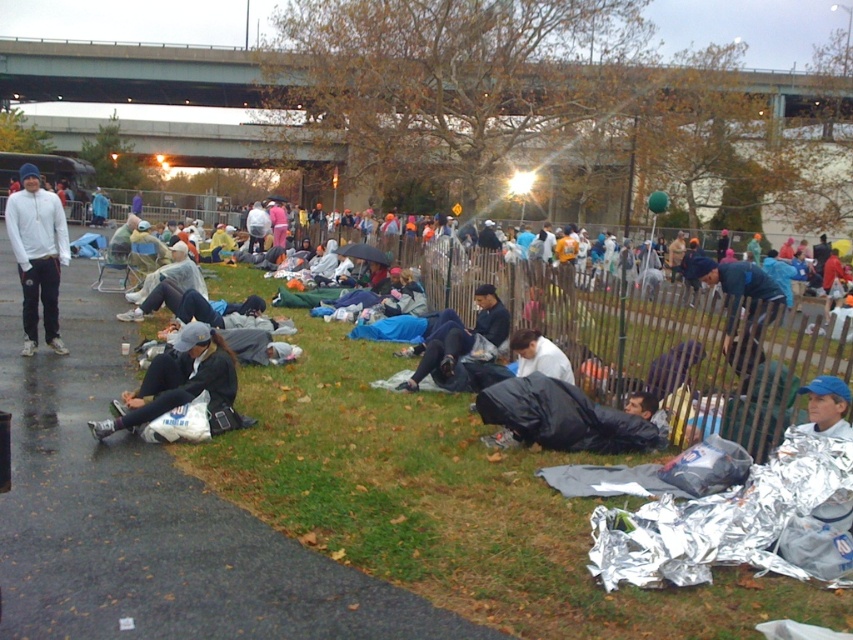
Question: Which object is the farthest from the metallic wire fence at center?

Choices:
 (A) white matte jacket at left
 (B) green concrete bridge at upper center
 (C) black asphalt at lower left
 (D) white matte shirt at center

Answer: (B)

Question: Observing the image, what is the correct spatial positioning of green concrete bridge at upper center in reference to blue matte jacket at lower right?

Choices:
 (A) left
 (B) right

Answer: (A)

Question: Estimate the real-world distances between objects in this image. Which object is farther from the black asphalt at lower left?

Choices:
 (A) white matte jacket at left
 (B) green concrete bridge at upper center
 (C) white matte shirt at center

Answer: (B)

Question: Which point appears farthest from the camera in this image?

Choices:
 (A) (260, 52)
 (B) (39, 189)

Answer: (A)

Question: Is the position of green concrete bridge at upper center more distant than that of blue matte jacket at lower right?

Choices:
 (A) yes
 (B) no

Answer: (A)

Question: Can you confirm if green concrete bridge at upper center is positioned below white matte shirt at center?

Choices:
 (A) no
 (B) yes

Answer: (A)